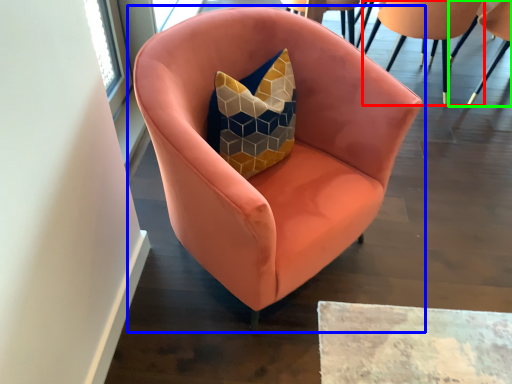
Question: Estimate the real-world distances between objects in this image. Which object is closer to chair (highlighted by a red box), chair (highlighted by a blue box) or chair (highlighted by a green box)?

Choices:
 (A) chair
 (B) chair

Answer: (B)